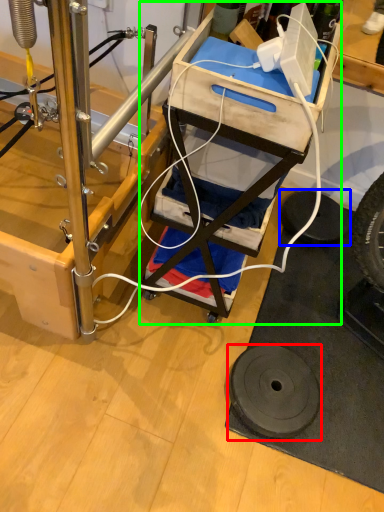
Question: Estimate the real-world distances between objects in this image. Which object is closer to wheel (highlighted by a red box), tire (highlighted by a blue box) or furniture (highlighted by a green box)?

Choices:
 (A) tire
 (B) furniture

Answer: (B)